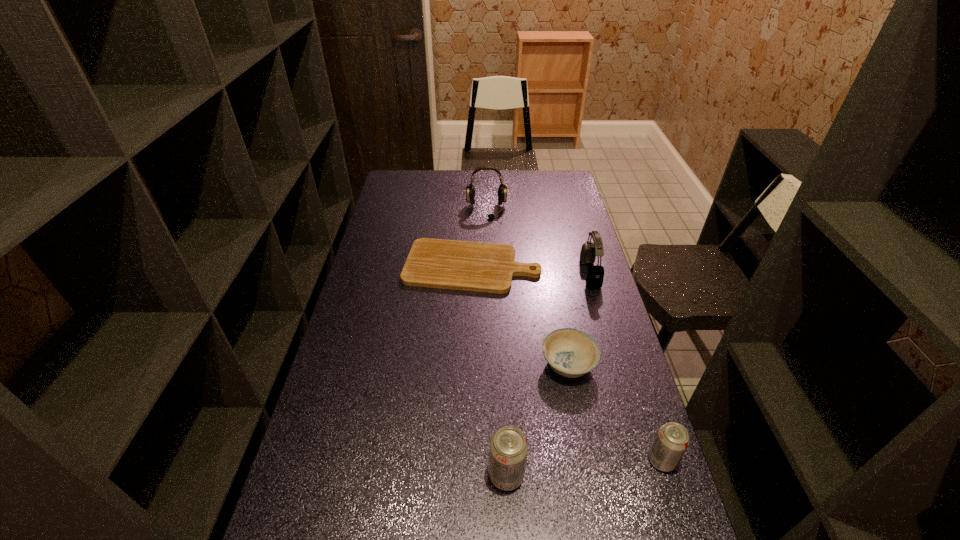
Given the evenly spaced soda cans in the image, where should an extra soda can be added on the left to preserve the spacing? Please point to a vacant space. Please provide its 2D coordinates. Your answer should be formatted as a tuple, i.e. [(x, y)], where the tuple contains the x and y coordinates of a point satisfying the conditions above.

[(343, 491)]